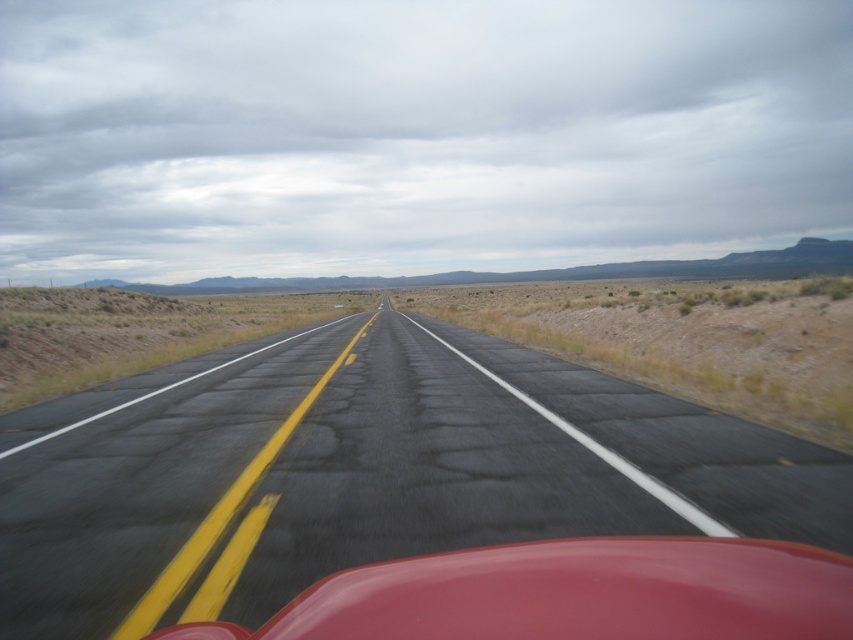
From the picture: Which is more to the right, asphalt road at center or glossy red car at center?

From the viewer's perspective, glossy red car at center appears more on the right side.

Can you confirm if asphalt road at center is wider than glossy red car at center?

Correct, the width of asphalt road at center exceeds that of glossy red car at center.

The width and height of the screenshot is (853, 640). Find the location of `asphalt road at center`. asphalt road at center is located at coordinates (410, 500).